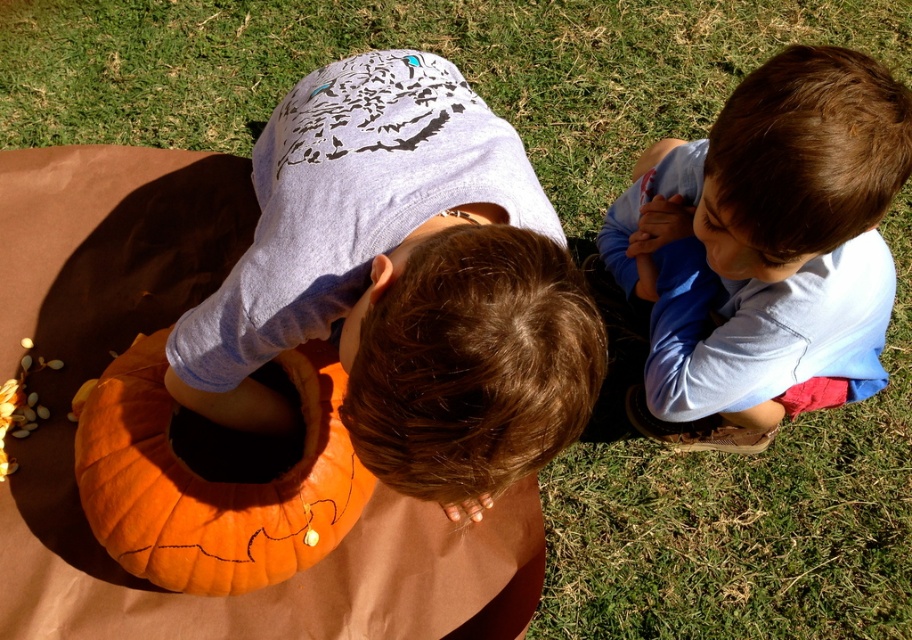
You are a photographer trying to capture a photo of the orange matte pumpkin at center. You notice the blue cotton shirt at upper right is blocking part of the pumpkin. Based on their heights, can you adjust your camera angle to avoid the shirt?

The blue cotton shirt at upper right is taller than the orange matte pumpkin at center, so lowering the camera angle might help avoid the shirt blocking the pumpkin.

You are a drone operator trying to locate the matte orange pumpkin at center in an image. The image has a coordinate system where the bottom left corner is the origin. Can you confirm if the pumpkin is located in the upper half of the image?

The matte orange pumpkin at center is at point coordinates of (403, 282). Since the y coordinate is 0.443, which is less than 0.5, the pumpkin is in the lower half of the image. Therefore, the pumpkin is not in the upper half of the image.

You are a photographer trying to capture a candid shot of the two children. You notice the matte orange pumpkin at center and the blue cotton shirt at upper right. Which object is positioned to the left of the other?

The matte orange pumpkin at center is to the left of the blue cotton shirt at upper right.